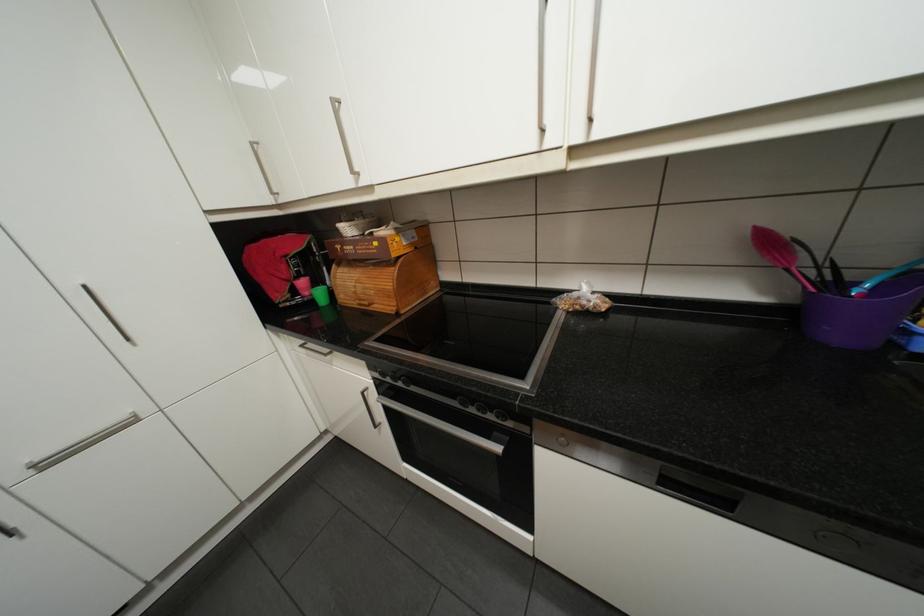
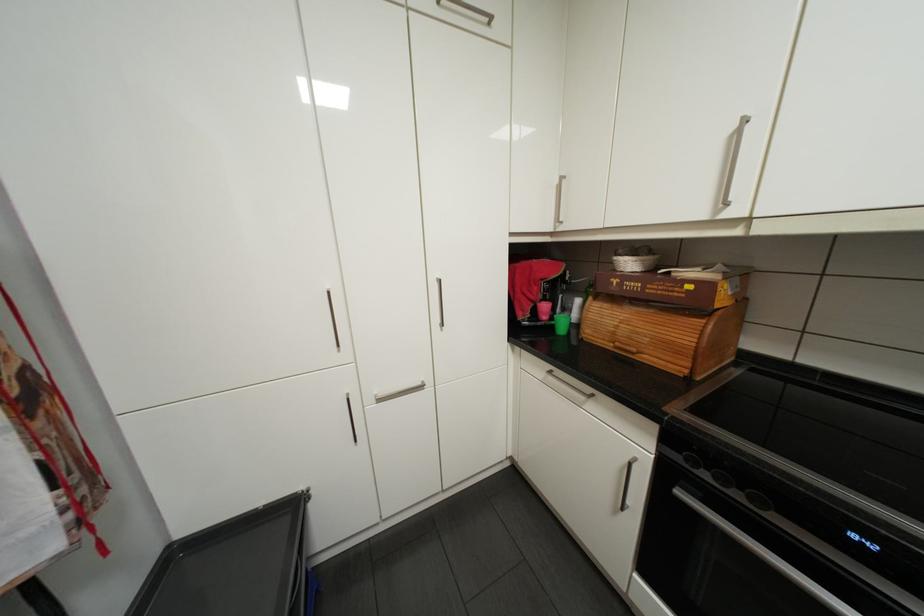
Find the pixel in the second image that matches (x=346, y=264) in the first image.

(602, 297)